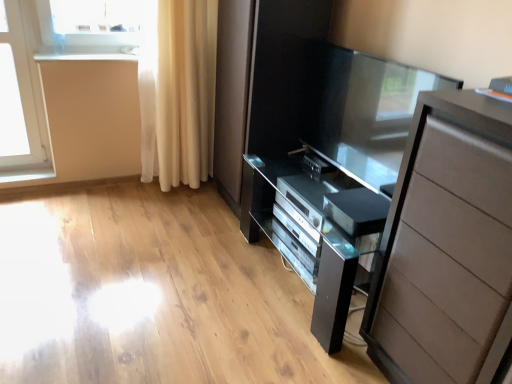
Question: From a real-world perspective, is transparent glass screen door at center located higher than satin silver dvd player at lower center, arranged as the 2th appliance when viewed from the top?

Choices:
 (A) yes
 (B) no

Answer: (A)

Question: Is transparent glass screen door at center thinner than satin silver dvd player at lower center, arranged as the 2th appliance when viewed from the top?

Choices:
 (A) yes
 (B) no

Answer: (A)

Question: Is the depth of transparent glass screen door at center greater than that of satin silver dvd player at lower center, the 1th appliance when ordered from bottom to top?

Choices:
 (A) no
 (B) yes

Answer: (A)

Question: Is transparent glass screen door at center in contact with satin silver dvd player at lower center, the 1th appliance when ordered from bottom to top?

Choices:
 (A) yes
 (B) no

Answer: (B)

Question: Can you confirm if transparent glass screen door at center is taller than satin silver dvd player at lower center, the 1th appliance from the front?

Choices:
 (A) no
 (B) yes

Answer: (B)

Question: Considering the relative sizes of transparent glass screen door at center and satin silver dvd player at lower center, the 1th appliance when ordered from bottom to top, in the image provided, is transparent glass screen door at center bigger than satin silver dvd player at lower center, the 1th appliance when ordered from bottom to top,?

Choices:
 (A) yes
 (B) no

Answer: (A)

Question: Is satin black tv at center, the 1th appliance viewed from the back, smaller than matte brown chest of drawers at right?

Choices:
 (A) no
 (B) yes

Answer: (B)

Question: From the image's perspective, would you say satin black tv at center, which is the 1th appliance in top-to-bottom order, is positioned over matte brown chest of drawers at right?

Choices:
 (A) no
 (B) yes

Answer: (B)

Question: Is matte brown chest of drawers at right completely or partially inside satin black tv at center, which ranks as the 2th appliance in front-to-back order?

Choices:
 (A) no
 (B) yes

Answer: (A)

Question: From a real-world perspective, is satin black tv at center, which is the 1th appliance in top-to-bottom order, beneath matte brown chest of drawers at right?

Choices:
 (A) no
 (B) yes

Answer: (B)

Question: Does satin black tv at center, the second appliance from the bottom, appear on the left side of matte brown chest of drawers at right?

Choices:
 (A) no
 (B) yes

Answer: (B)

Question: Can you see satin black tv at center, which ranks as the 2th appliance in front-to-back order, touching matte brown chest of drawers at right?

Choices:
 (A) no
 (B) yes

Answer: (A)

Question: Is matte brown chest of drawers at right thinner than satin silver dvd player at lower center, the 1th appliance when ordered from bottom to top?

Choices:
 (A) yes
 (B) no

Answer: (B)